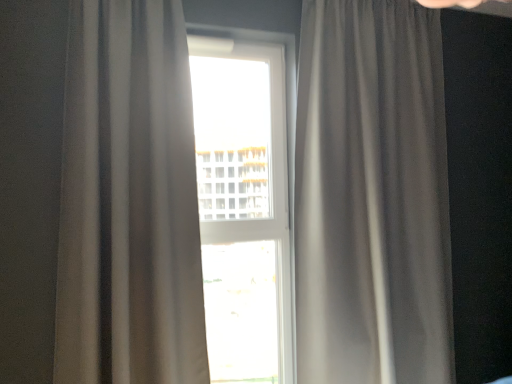
Where is `satin gray curtain at right, which appears as the 2th curtain when viewed from the left`? This screenshot has width=512, height=384. satin gray curtain at right, which appears as the 2th curtain when viewed from the left is located at coordinates (372, 196).

Is transparent glass window at center placed right next to matte gray curtain at center, acting as the 2th curtain starting from the right?

transparent glass window at center is not next to matte gray curtain at center, acting as the 2th curtain starting from the right, and they're not touching.

Is transparent glass window at center aimed at matte gray curtain at center, acting as the 2th curtain starting from the right?

No.

Is transparent glass window at center spatially inside matte gray curtain at center, arranged as the 1th curtain when viewed from the left, or outside of it?

transparent glass window at center exists outside the volume of matte gray curtain at center, arranged as the 1th curtain when viewed from the left.

Consider the image. From the image's perspective, between transparent glass window at center and matte gray curtain at center, arranged as the 1th curtain when viewed from the left, who is located below?

transparent glass window at center appears lower in the image.

Looking at this image, considering the sizes of objects matte gray curtain at center, acting as the 2th curtain starting from the right, and satin gray curtain at right, which is the 1th curtain in right-to-left order, in the image provided, who is taller, matte gray curtain at center, acting as the 2th curtain starting from the right, or satin gray curtain at right, which is the 1th curtain in right-to-left order,?

With more height is satin gray curtain at right, which is the 1th curtain in right-to-left order.

How different are the orientations of matte gray curtain at center, arranged as the 1th curtain when viewed from the left, and satin gray curtain at right, which appears as the 2th curtain when viewed from the left, in degrees?

The facing directions of matte gray curtain at center, arranged as the 1th curtain when viewed from the left, and satin gray curtain at right, which appears as the 2th curtain when viewed from the left, are 0.333 degrees apart.

Which object is closer to the camera taking this photo, matte gray curtain at center, acting as the 2th curtain starting from the right, or satin gray curtain at right, which appears as the 2th curtain when viewed from the left?

matte gray curtain at center, acting as the 2th curtain starting from the right, is closer to the camera.

Considering the sizes of objects matte gray curtain at center, acting as the 2th curtain starting from the right, and satin gray curtain at right, which appears as the 2th curtain when viewed from the left, in the image provided, who is wider, matte gray curtain at center, acting as the 2th curtain starting from the right, or satin gray curtain at right, which appears as the 2th curtain when viewed from the left,?

With larger width is satin gray curtain at right, which appears as the 2th curtain when viewed from the left.

From the image's perspective, which one is positioned higher, matte gray curtain at center, acting as the 2th curtain starting from the right, or transparent glass window at center?

From the image's view, matte gray curtain at center, acting as the 2th curtain starting from the right, is above.

Is matte gray curtain at center, arranged as the 1th curtain when viewed from the left, positioned far away from transparent glass window at center?

Yes, matte gray curtain at center, arranged as the 1th curtain when viewed from the left, and transparent glass window at center are located far from each other.

Considering the sizes of objects matte gray curtain at center, acting as the 2th curtain starting from the right, and transparent glass window at center in the image provided, who is bigger, matte gray curtain at center, acting as the 2th curtain starting from the right, or transparent glass window at center?

matte gray curtain at center, acting as the 2th curtain starting from the right.

Between matte gray curtain at center, arranged as the 1th curtain when viewed from the left, and transparent glass window at center, which one appears on the left side from the viewer's perspective?

matte gray curtain at center, arranged as the 1th curtain when viewed from the left, is more to the left.

Is transparent glass window at center aimed at satin gray curtain at right, which is the 1th curtain in right-to-left order?

No, transparent glass window at center does not turn towards satin gray curtain at right, which is the 1th curtain in right-to-left order.

From the image's perspective, is transparent glass window at center located above satin gray curtain at right, which appears as the 2th curtain when viewed from the left?

No.

Does transparent glass window at center have a greater height compared to satin gray curtain at right, which appears as the 2th curtain when viewed from the left?

No, transparent glass window at center is not taller than satin gray curtain at right, which appears as the 2th curtain when viewed from the left.

Which of these two, transparent glass window at center or satin gray curtain at right, which appears as the 2th curtain when viewed from the left, is bigger?

With larger size is satin gray curtain at right, which appears as the 2th curtain when viewed from the left.

From a real-world perspective, is satin gray curtain at right, which is the 1th curtain in right-to-left order, positioned over transparent glass window at center based on gravity?

Yes.

Between satin gray curtain at right, which is the 1th curtain in right-to-left order, and transparent glass window at center, which one has more height?

satin gray curtain at right, which is the 1th curtain in right-to-left order.

Considering the sizes of objects satin gray curtain at right, which is the 1th curtain in right-to-left order, and transparent glass window at center in the image provided, who is wider, satin gray curtain at right, which is the 1th curtain in right-to-left order, or transparent glass window at center?

Wider between the two is satin gray curtain at right, which is the 1th curtain in right-to-left order.

Is point (374, 114) closer to viewer compared to point (119, 56)?

That is False.

Is satin gray curtain at right, which is the 1th curtain in right-to-left order, oriented towards matte gray curtain at center, arranged as the 1th curtain when viewed from the left?

No, satin gray curtain at right, which is the 1th curtain in right-to-left order, is not turned towards matte gray curtain at center, arranged as the 1th curtain when viewed from the left.

There is a satin gray curtain at right, which appears as the 2th curtain when viewed from the left. What are the coordinates of `curtain above it (from a real-world perspective)` in the screenshot? It's located at (129, 201).

Locate an element on the screen. The height and width of the screenshot is (384, 512). window below the matte gray curtain at center, arranged as the 1th curtain when viewed from the left (from a real-world perspective) is located at coordinates pyautogui.click(x=243, y=202).

The height and width of the screenshot is (384, 512). Find the location of `curtain that is above the satin gray curtain at right, which is the 1th curtain in right-to-left order (from the image's perspective)`. curtain that is above the satin gray curtain at right, which is the 1th curtain in right-to-left order (from the image's perspective) is located at coordinates (129, 201).

Based on their spatial positions, is transparent glass window at center or satin gray curtain at right, which is the 1th curtain in right-to-left order, further from matte gray curtain at center, acting as the 2th curtain starting from the right?

Among the two, transparent glass window at center is located further to matte gray curtain at center, acting as the 2th curtain starting from the right.

Estimate the real-world distances between objects in this image. Which object is further from satin gray curtain at right, which appears as the 2th curtain when viewed from the left, matte gray curtain at center, arranged as the 1th curtain when viewed from the left, or transparent glass window at center?

transparent glass window at center lies further to satin gray curtain at right, which appears as the 2th curtain when viewed from the left, than the other object.

Estimate the real-world distances between objects in this image. Which object is closer to matte gray curtain at center, arranged as the 1th curtain when viewed from the left, satin gray curtain at right, which is the 1th curtain in right-to-left order, or transparent glass window at center?

satin gray curtain at right, which is the 1th curtain in right-to-left order, is positioned closer to the anchor matte gray curtain at center, arranged as the 1th curtain when viewed from the left.

In the scene shown: From the image, which object appears to be farther from satin gray curtain at right, which appears as the 2th curtain when viewed from the left, transparent glass window at center or matte gray curtain at center, arranged as the 1th curtain when viewed from the left?

transparent glass window at center lies further to satin gray curtain at right, which appears as the 2th curtain when viewed from the left, than the other object.

From the image, which object appears to be nearer to transparent glass window at center, matte gray curtain at center, arranged as the 1th curtain when viewed from the left, or satin gray curtain at right, which is the 1th curtain in right-to-left order?

Among the two, satin gray curtain at right, which is the 1th curtain in right-to-left order, is located nearer to transparent glass window at center.

Looking at the image, which one is located closer to transparent glass window at center, satin gray curtain at right, which appears as the 2th curtain when viewed from the left, or matte gray curtain at center, arranged as the 1th curtain when viewed from the left?

satin gray curtain at right, which appears as the 2th curtain when viewed from the left.

Locate an element on the screen. window located between matte gray curtain at center, arranged as the 1th curtain when viewed from the left, and satin gray curtain at right, which is the 1th curtain in right-to-left order, in the left-right direction is located at coordinates (243, 202).